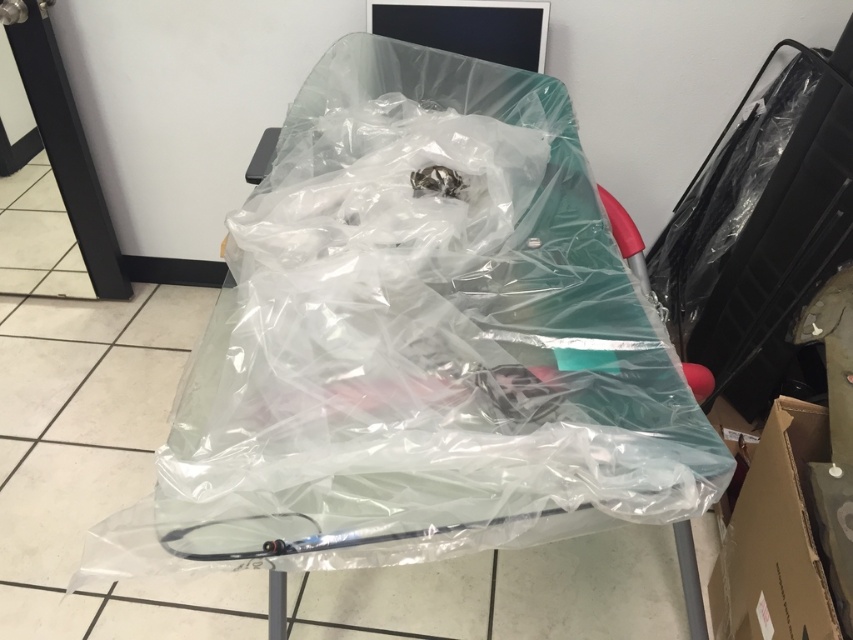
Which is behind, point (329, 320) or point (787, 433)?

The point (787, 433) is behind.

Who is positioned more to the left, transparent plastic bag at center or brown cardboard box at lower right?

From the viewer's perspective, transparent plastic bag at center appears more on the left side.

Between point (634, 403) and point (729, 538), which one is positioned in front?

Positioned in front is point (634, 403).

The image size is (853, 640). Identify the location of transparent plastic bag at center. (427, 349).